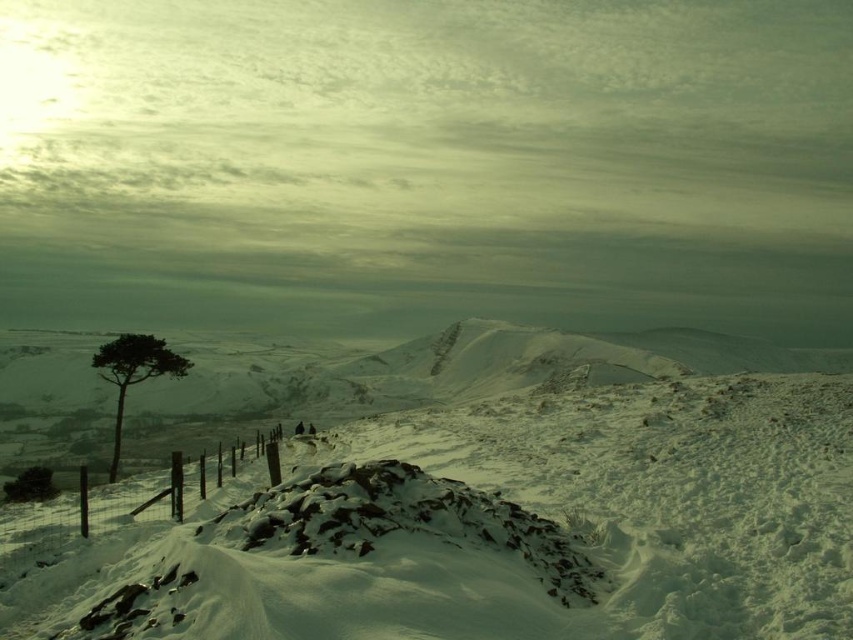
You are an artist planning to paint this winter scene. You want to ensure the white powdery snow at center and the green leafy tree at left are proportionally accurate. Which object should you paint larger to maintain the correct scale?

The white powdery snow at center should be painted larger than the green leafy tree at left to maintain the correct scale since it is bigger in the scene.

You are a hiker looking for a path to the mountains in the distance. You see the wooden post fence at lower left and the green leafy tree at left. Which object is closer to you, the observer?

The wooden post fence at lower left is located below green leafy tree at left, so the wooden post fence at lower left is closer to you.

You are a hiker trying to reach the distant hills. You see the white powdery snow at center and the wooden post fence at lower left. Which object is closer to you as you look towards the distant hills?

The white powdery snow at center is closer to you because it is in front of the wooden post fence at lower left.